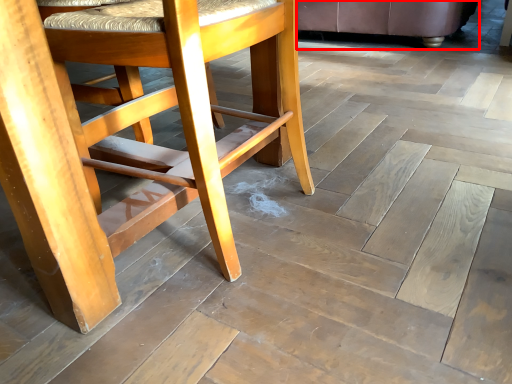
Question: From the image's perspective, where is chair (annotated by the red box) located relative to chair?

Choices:
 (A) above
 (B) below

Answer: (A)